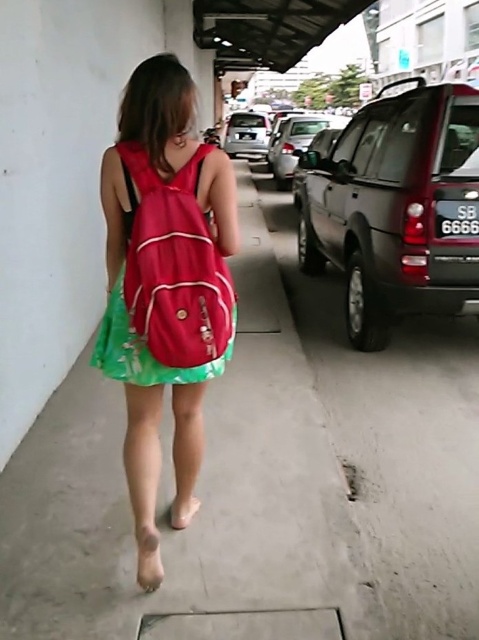
Question: Where is dark gray metallic suv at right located in relation to transparent plastic sandal at lower center in the image?

Choices:
 (A) left
 (B) right

Answer: (B)

Question: Based on their relative distances, which object is nearer to the metallic silver car at center?

Choices:
 (A) transparent plastic sandal at lower center
 (B) brown leather sandal at lower center
 (C) matte pink backpack at center

Answer: (C)

Question: Among these points, which one is nearest to the camera?

Choices:
 (A) (248, 122)
 (B) (271, 148)
 (C) (192, 394)
 (D) (380, 244)

Answer: (C)

Question: Can you confirm if smooth concrete pavement at center is wider than transparent plastic sandal at lower center?

Choices:
 (A) no
 (B) yes

Answer: (B)

Question: Is silver metallic car at center behind transparent plastic sandal at lower center?

Choices:
 (A) no
 (B) yes

Answer: (B)

Question: Which point appears farthest from the camera in this image?

Choices:
 (A) (184, 504)
 (B) (304, 616)
 (C) (478, 156)

Answer: (C)